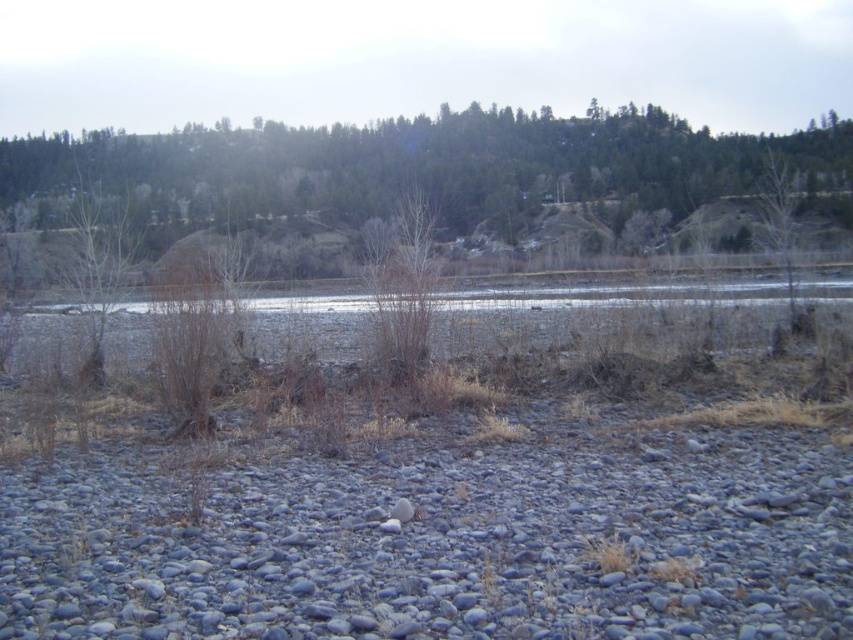
Does brown/dry grass at left appear on the right side of brown textured tree at right?

Incorrect, brown/dry grass at left is not on the right side of brown textured tree at right.

Identify the location of brown/dry grass at left. (96, 268).

Where is `brown/dry grass at left`? The image size is (853, 640). brown/dry grass at left is located at coordinates (96, 268).